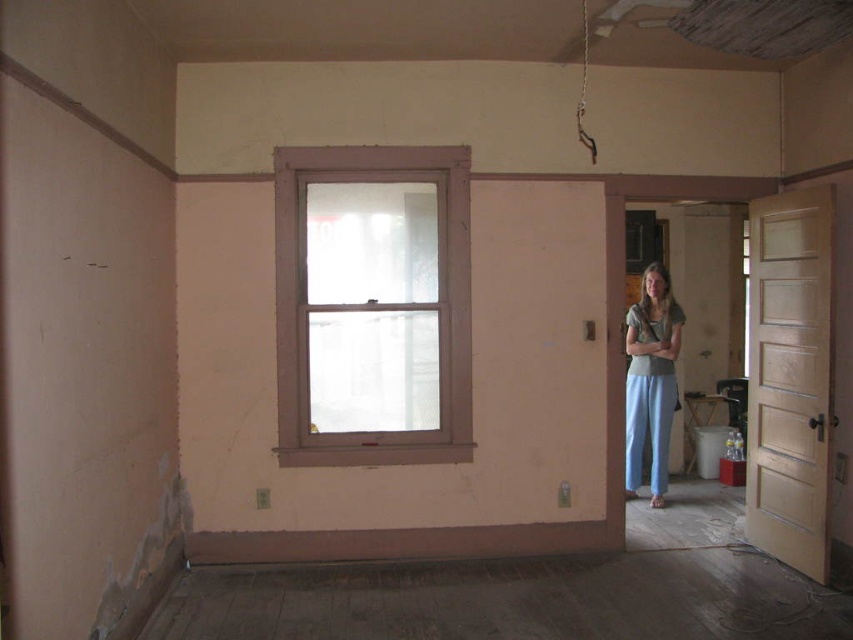
This screenshot has height=640, width=853. In order to click on white painted wood window at center in this screenshot , I will do `click(372, 305)`.

Identify the location of white painted wood window at center. (372, 305).